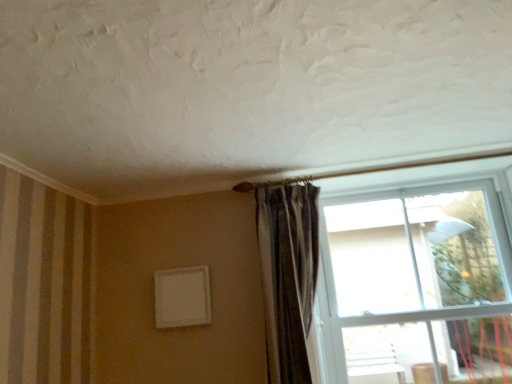
Question: Is point (308, 329) positioned closer to the camera than point (449, 316)?

Choices:
 (A) farther
 (B) closer

Answer: (B)

Question: Looking at the image, does striped fabric curtain at center seem bigger or smaller compared to transparent glass window at upper right?

Choices:
 (A) big
 (B) small

Answer: (B)

Question: Is striped fabric curtain at center taller or shorter than transparent glass window at upper right?

Choices:
 (A) tall
 (B) short

Answer: (B)

Question: From the image's perspective, is transparent glass window at upper right above or below striped fabric curtain at center?

Choices:
 (A) above
 (B) below

Answer: (B)

Question: Considering the positions of transparent glass window at upper right and striped fabric curtain at center in the image, is transparent glass window at upper right bigger or smaller than striped fabric curtain at center?

Choices:
 (A) big
 (B) small

Answer: (A)

Question: Is transparent glass window at upper right situated inside striped fabric curtain at center or outside?

Choices:
 (A) inside
 (B) outside

Answer: (B)

Question: From their relative heights in the image, would you say transparent glass window at upper right is taller or shorter than striped fabric curtain at center?

Choices:
 (A) short
 (B) tall

Answer: (B)